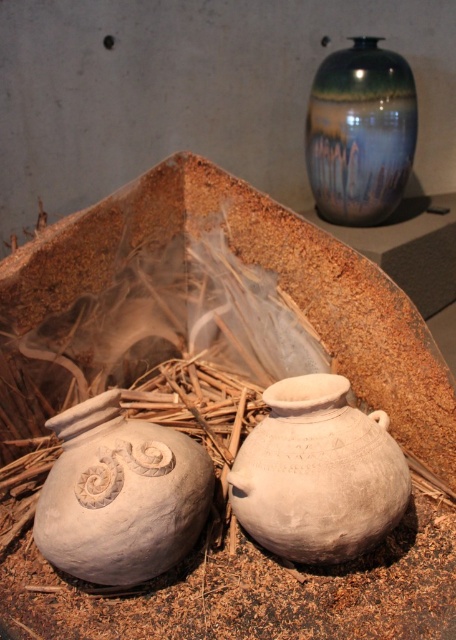
Question: Which object is the closest to the white clay pot at lower left?

Choices:
 (A) white matte clay pot at center
 (B) shiny ceramic vase at upper right

Answer: (A)

Question: Where is white clay pot at lower left located in relation to white matte clay pot at center in the image?

Choices:
 (A) right
 (B) left

Answer: (B)

Question: Is white clay pot at lower left bigger than shiny ceramic vase at upper right?

Choices:
 (A) no
 (B) yes

Answer: (A)

Question: Does white clay pot at lower left appear over shiny ceramic vase at upper right?

Choices:
 (A) yes
 (B) no

Answer: (B)

Question: Which object is the farthest from the white clay pot at lower left?

Choices:
 (A) shiny ceramic vase at upper right
 (B) white matte clay pot at center

Answer: (A)

Question: Based on their relative distances, which object is farther from the white clay pot at lower left?

Choices:
 (A) white matte clay pot at center
 (B) shiny ceramic vase at upper right

Answer: (B)